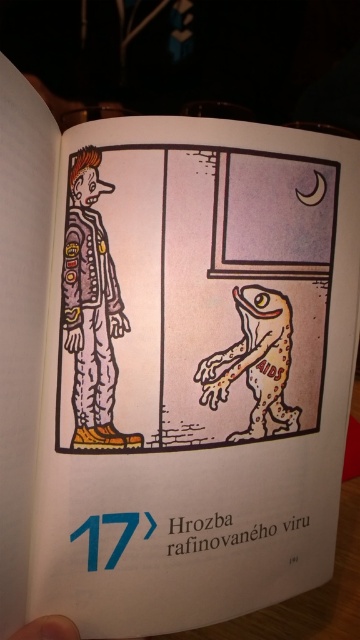
Does matte purple jumpsuit at center appear under brown textured lizard at center?

No.

Is matte purple jumpsuit at center taller than brown textured lizard at center?

Indeed, matte purple jumpsuit at center has a greater height compared to brown textured lizard at center.

Between point (87, 396) and point (282, 422), which one is positioned in front?

Point (87, 396) is in front.

Where is `matte purple jumpsuit at center`? matte purple jumpsuit at center is located at coordinates (92, 308).